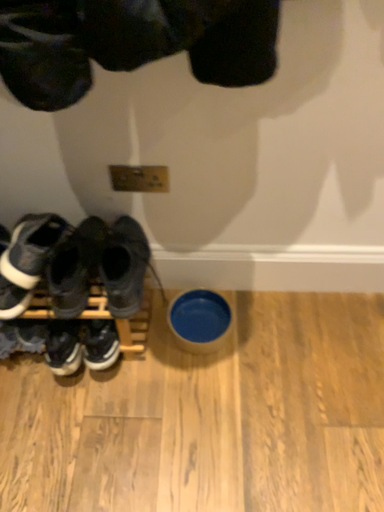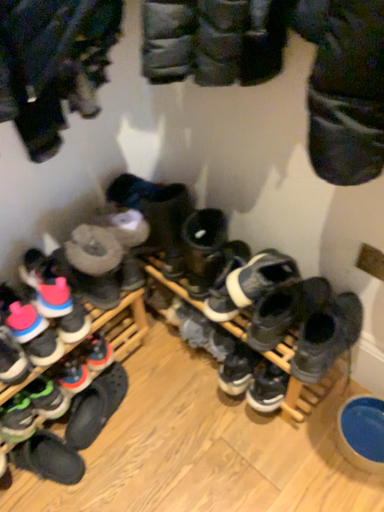
Question: Which way did the camera rotate in the video?

Choices:
 (A) rotated downward
 (B) rotated upward

Answer: (B)